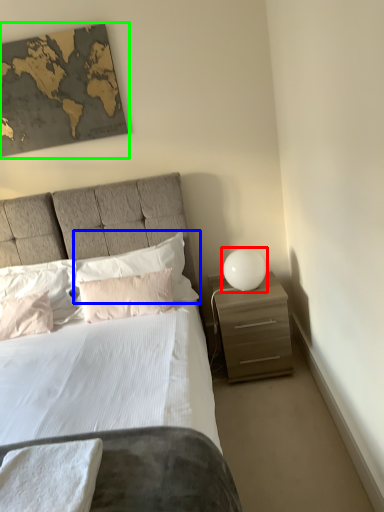
Question: Which object is positioned closest to table lamp (highlighted by a red box)? Select from pillow (highlighted by a blue box) and picture frame (highlighted by a green box).

Choices:
 (A) pillow
 (B) picture frame

Answer: (A)